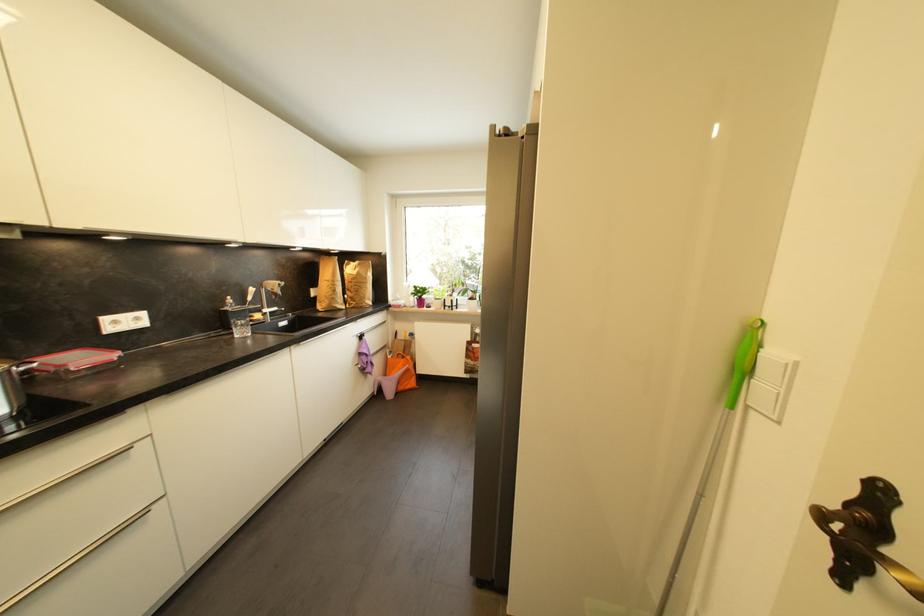
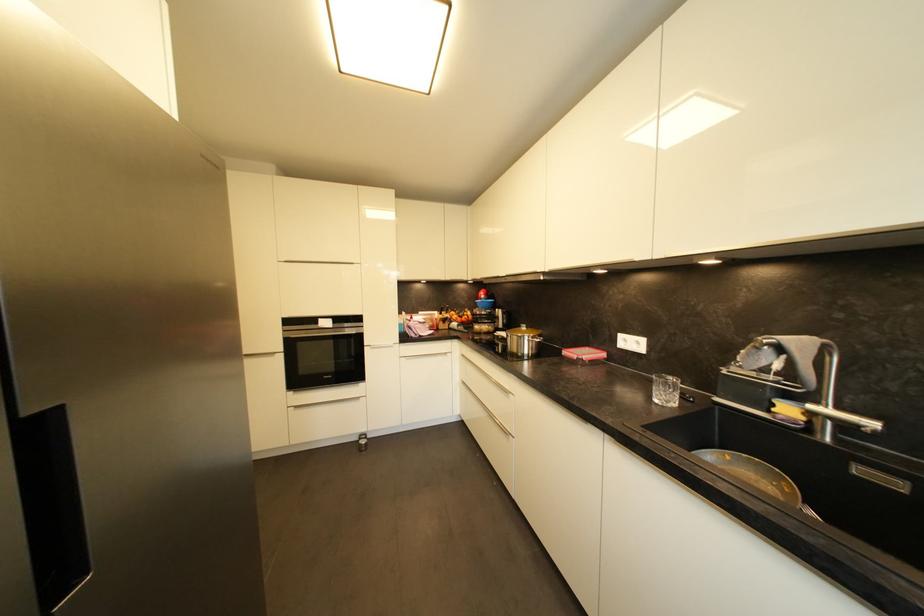
The point at (54, 355) is marked in the first image. Where is the corresponding point in the second image?

(602, 350)